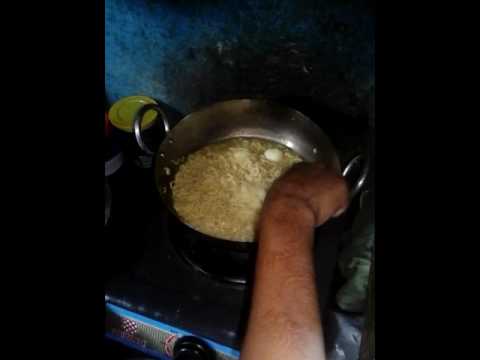
The width and height of the screenshot is (480, 360). In order to click on screws on left handle in this screenshot , I will do `click(171, 140)`, `click(162, 154)`.